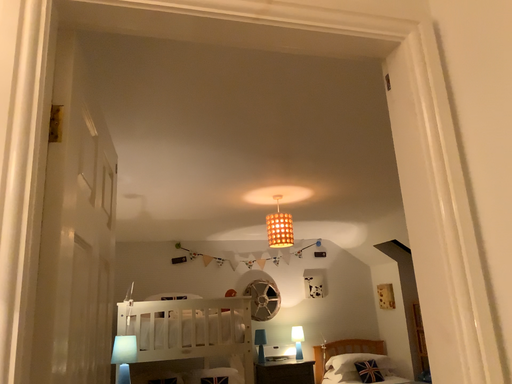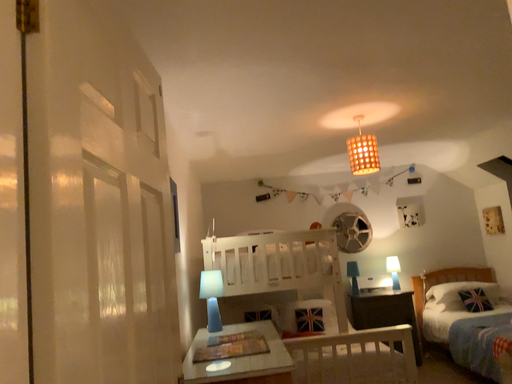
Question: How did the camera likely rotate when shooting the video?

Choices:
 (A) rotated downward
 (B) rotated upward

Answer: (A)